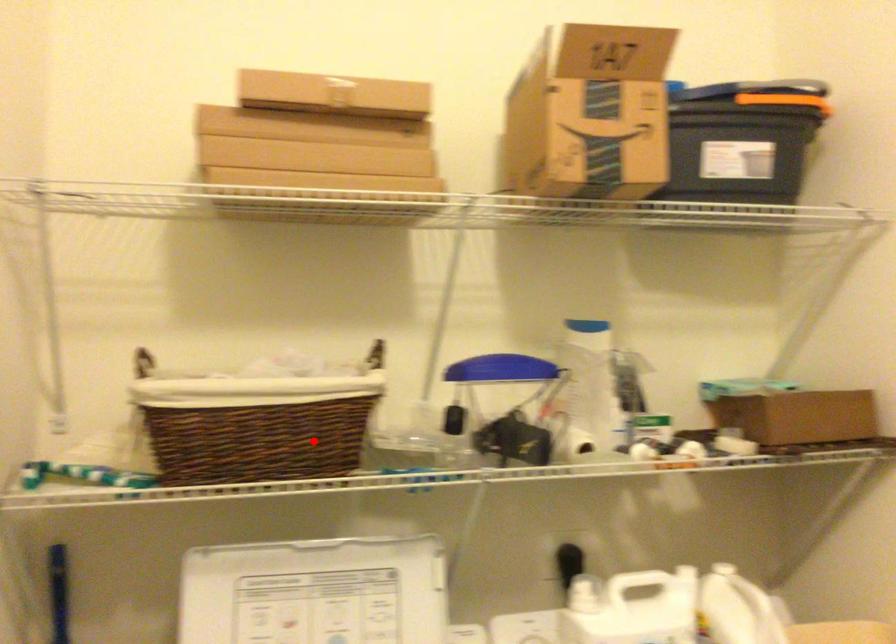
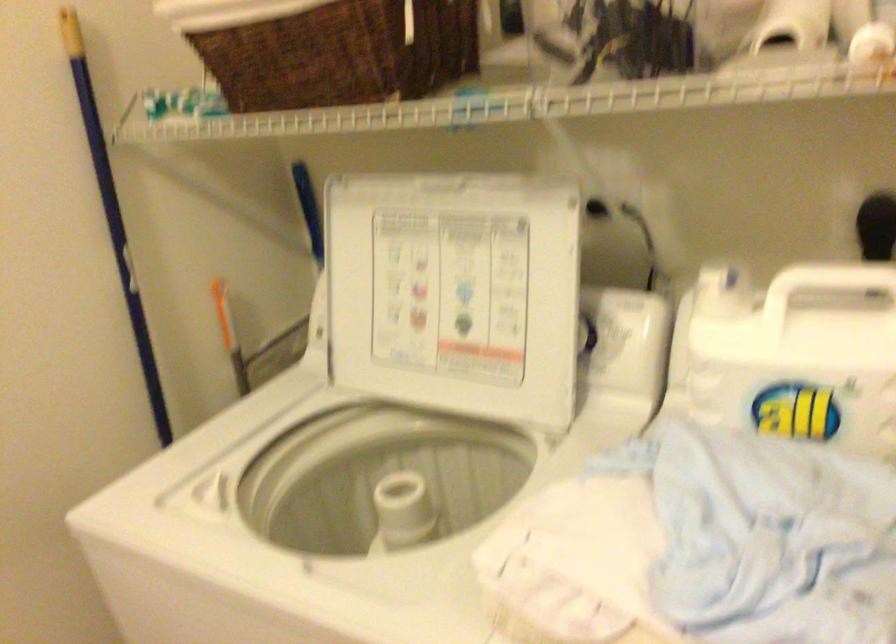
In the second image, find the point that corresponds to the highlighted location in the first image.

(340, 53)